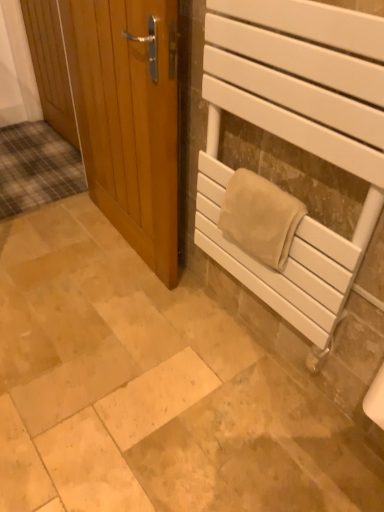
Question: Does white matte towel rack at right have a lesser height compared to wooden door at left, marked as the second door in a front-to-back arrangement?

Choices:
 (A) no
 (B) yes

Answer: (A)

Question: Would you say white matte towel rack at right contains wooden door at left, the second door when ordered from right to left?

Choices:
 (A) no
 (B) yes

Answer: (A)

Question: From the image's perspective, is white matte towel rack at right above wooden door at left, marked as the second door in a front-to-back arrangement?

Choices:
 (A) no
 (B) yes

Answer: (A)

Question: Considering the relative sizes of white matte towel rack at right and wooden door at left, the second door when ordered from right to left, in the image provided, is white matte towel rack at right bigger than wooden door at left, the second door when ordered from right to left,?

Choices:
 (A) yes
 (B) no

Answer: (A)

Question: Is white matte towel rack at right outside wooden door at left, which is counted as the first door, starting from the back?

Choices:
 (A) yes
 (B) no

Answer: (A)

Question: Is white matte towel rack at right taller than wooden door at left, which is counted as the first door, starting from the back?

Choices:
 (A) no
 (B) yes

Answer: (B)

Question: Considering the relative positions of white matte towel rack at right and light brown wooden door at left, the second door from the left, in the image provided, is white matte towel rack at right to the left of light brown wooden door at left, the second door from the left, from the viewer's perspective?

Choices:
 (A) no
 (B) yes

Answer: (A)

Question: Is white matte towel rack at right to the right of light brown wooden door at left, placed as the first door when sorted from right to left, from the viewer's perspective?

Choices:
 (A) yes
 (B) no

Answer: (A)

Question: Is the position of white matte towel rack at right less distant than that of light brown wooden door at left, arranged as the 2th door when viewed from the back?

Choices:
 (A) yes
 (B) no

Answer: (A)

Question: Would you say light brown wooden door at left, the second door from the left, is part of white matte towel rack at right's contents?

Choices:
 (A) yes
 (B) no

Answer: (B)

Question: Does white matte towel rack at right have a greater height compared to light brown wooden door at left, arranged as the 2th door when viewed from the back?

Choices:
 (A) yes
 (B) no

Answer: (B)

Question: Can you confirm if white matte towel rack at right is wider than light brown wooden door at left, the second door from the left?

Choices:
 (A) yes
 (B) no

Answer: (B)

Question: Does light brown wooden door at left, placed as the first door when sorted from right to left, have a greater height compared to beige soft towel at right?

Choices:
 (A) yes
 (B) no

Answer: (A)